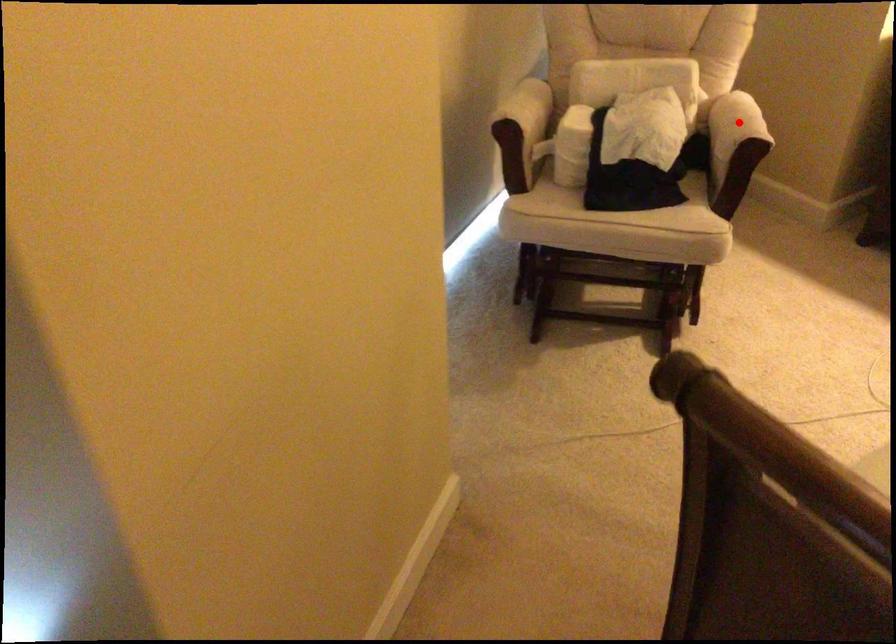
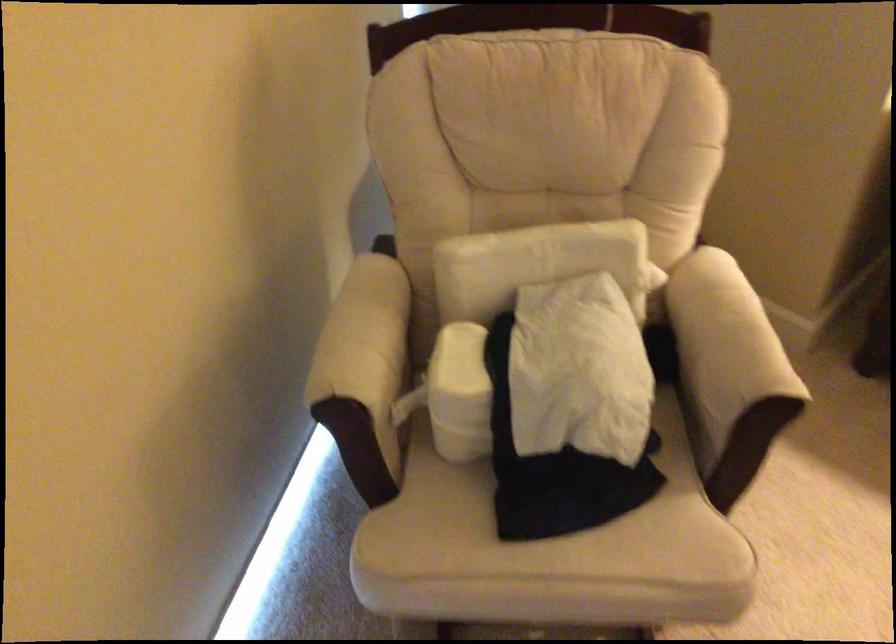
Where in the second image is the point corresponding to the highlighted location from the first image?

(724, 348)